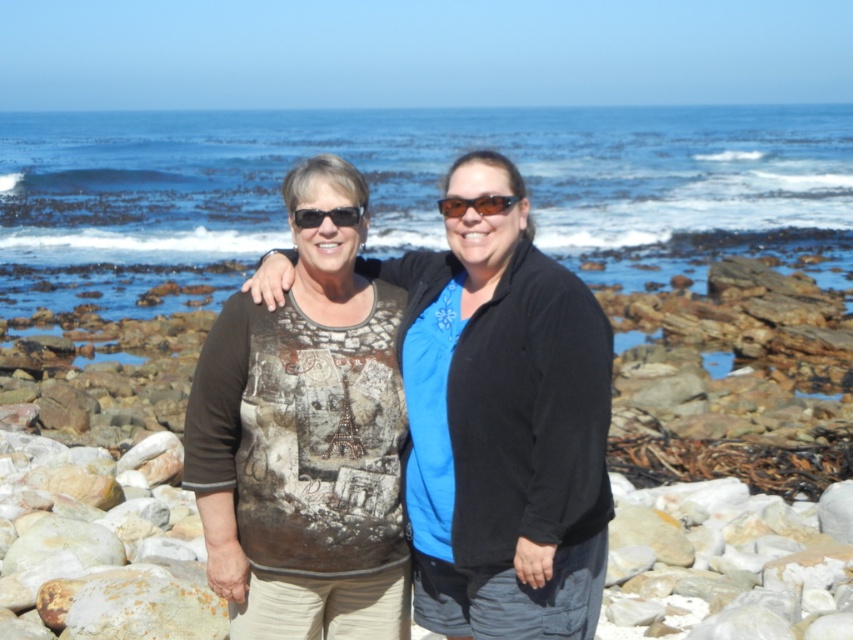
Question: Which point appears closest to the camera in this image?

Choices:
 (A) pos(312,216)
 (B) pos(579,426)
 (C) pos(741,132)

Answer: (B)

Question: Is printed cotton shirt at center positioned in front of black plastic sunglasses at center?

Choices:
 (A) no
 (B) yes

Answer: (B)

Question: Considering the relative positions of blue water at center and black plastic sunglasses at center in the image provided, where is blue water at center located with respect to black plastic sunglasses at center?

Choices:
 (A) left
 (B) right

Answer: (A)

Question: Which point is closer to the camera?

Choices:
 (A) blue water at center
 (B) printed cotton shirt at center
 (C) black plastic sunglasses at center

Answer: (B)

Question: Which point is closer to the camera taking this photo?

Choices:
 (A) (538, 452)
 (B) (334, 214)

Answer: (A)

Question: Considering the relative positions of printed cotton shirt at center and black plastic sunglasses at center in the image provided, where is printed cotton shirt at center located with respect to black plastic sunglasses at center?

Choices:
 (A) above
 (B) below

Answer: (B)